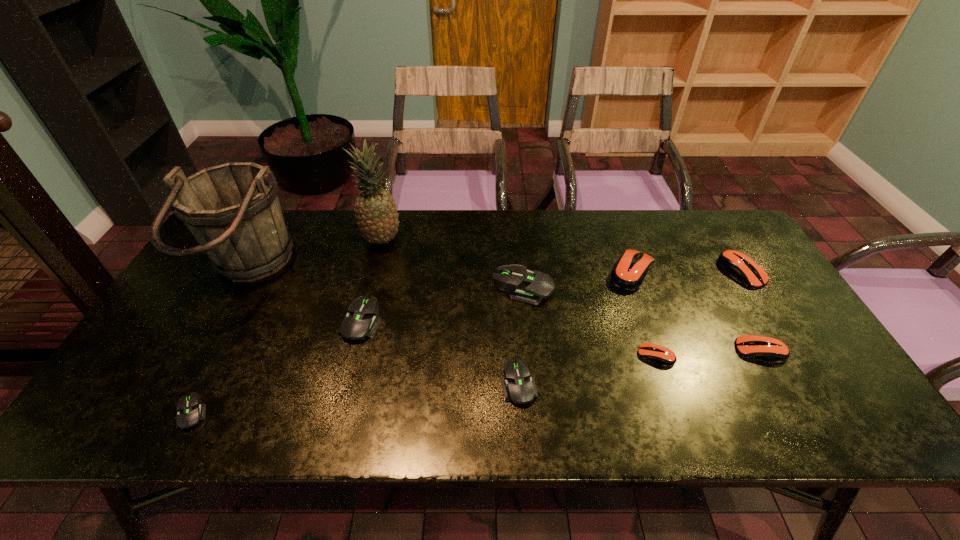
You are a GUI agent. You are given a task and a screenshot of the screen. Output one action in this format:
    pyautogui.click(x=<x>, y=<y>)
    Task: Click on the vacant space at the right edge
    
    Given the screenshot: What is the action you would take?
    pyautogui.click(x=717, y=283)

Identify the location of vacant space at the far right corner of the desktop. This screenshot has width=960, height=540. (713, 251).

Locate an element on the screen. free space between the bucket and the biggest orange computer mouse is located at coordinates (440, 272).

I want to click on empty location between the biggest orange computer mouse and the leftmost gray computer mouse, so click(413, 342).

Locate an element on the screen. vacant space in between the biggest orange computer mouse and the bucket is located at coordinates (440, 272).

You are a GUI agent. You are given a task and a screenshot of the screen. Output one action in this format:
    pyautogui.click(x=<x>, y=<y>)
    Task: Click on the vacant region between the smallest orange computer mouse and the third smallest orange computer mouse
    The width and height of the screenshot is (960, 540).
    Given the screenshot: What is the action you would take?
    pyautogui.click(x=699, y=314)

At what (x,y) coordinates should I click in order to perform the action: click on free space between the biggest gray computer mouse and the biggest orange computer mouse. Please return your answer as a coordinate pair (x, y). The height and width of the screenshot is (540, 960). Looking at the image, I should click on (578, 280).

Identify the location of free space that is in between the third smallest orange computer mouse and the second smallest orange computer mouse. (751, 312).

The image size is (960, 540). What are the coordinates of `free spot between the second computer mouse from left to right and the pineapple` in the screenshot? It's located at (372, 281).

The width and height of the screenshot is (960, 540). What are the coordinates of `unoccupied area between the smallest orange computer mouse and the biggest gray computer mouse` in the screenshot? It's located at (589, 322).